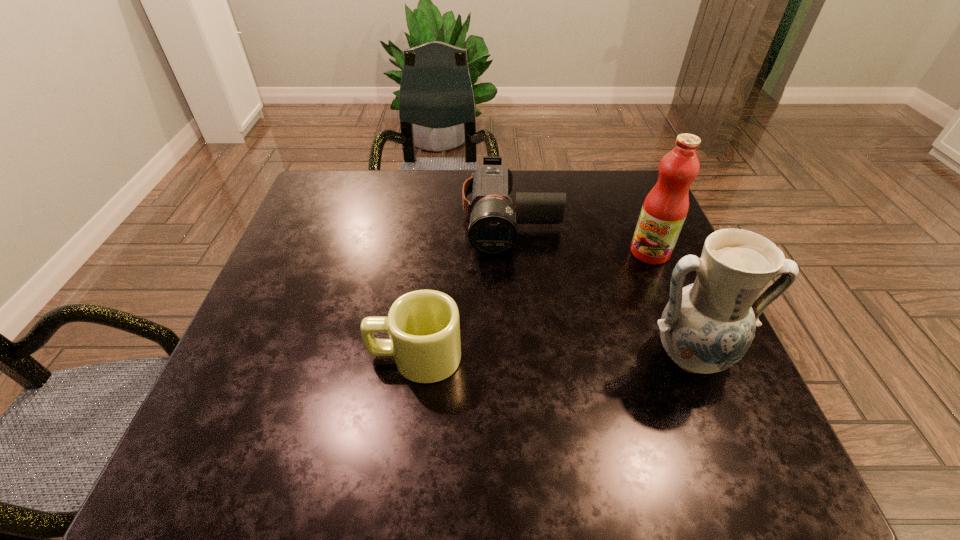
Where is `mug`? Image resolution: width=960 pixels, height=540 pixels. mug is located at coordinates (424, 328).

Where is `pottery`? The image size is (960, 540). pottery is located at coordinates (706, 327).

Locate an element on the screen. This screenshot has height=540, width=960. fruit juice is located at coordinates (665, 208).

Locate an element on the screen. This screenshot has width=960, height=540. camcorder is located at coordinates (493, 229).

Find the location of a particular element. The image size is (960, 540). vacant space located with the handle on the side of the mug is located at coordinates (323, 356).

Find the location of `vacant region located 0.090m with the handle on the side of the mug`. vacant region located 0.090m with the handle on the side of the mug is located at coordinates (323, 356).

Where is `vacant region located 0.050m with the handle on the side of the mug`? This screenshot has width=960, height=540. vacant region located 0.050m with the handle on the side of the mug is located at coordinates (343, 356).

Image resolution: width=960 pixels, height=540 pixels. I want to click on vacant space located 0.090m on the front label of the fruit juice, so click(615, 279).

Find the location of a particular element. free space located 0.090m on the front label of the fruit juice is located at coordinates (615, 279).

I want to click on blank area located 0.140m on the front label of the fruit juice, so click(x=602, y=289).